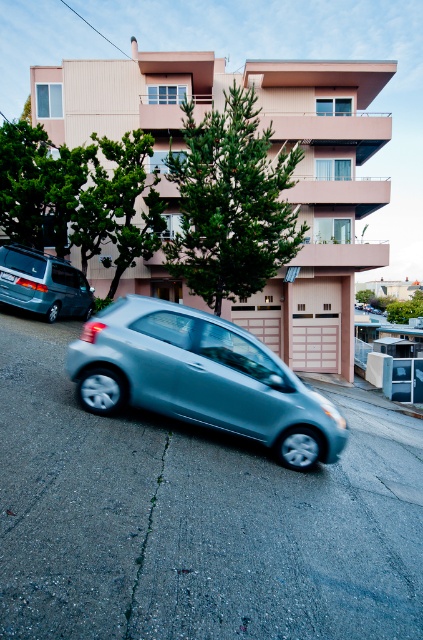
Is satin silver car at center above metallic silver minivan at left?

Incorrect, satin silver car at center is not positioned above metallic silver minivan at left.

Between point (164, 337) and point (38, 253), which one is positioned behind?

The point (38, 253) is more distant.

Image resolution: width=423 pixels, height=640 pixels. Identify the location of satin silver car at center. click(200, 378).